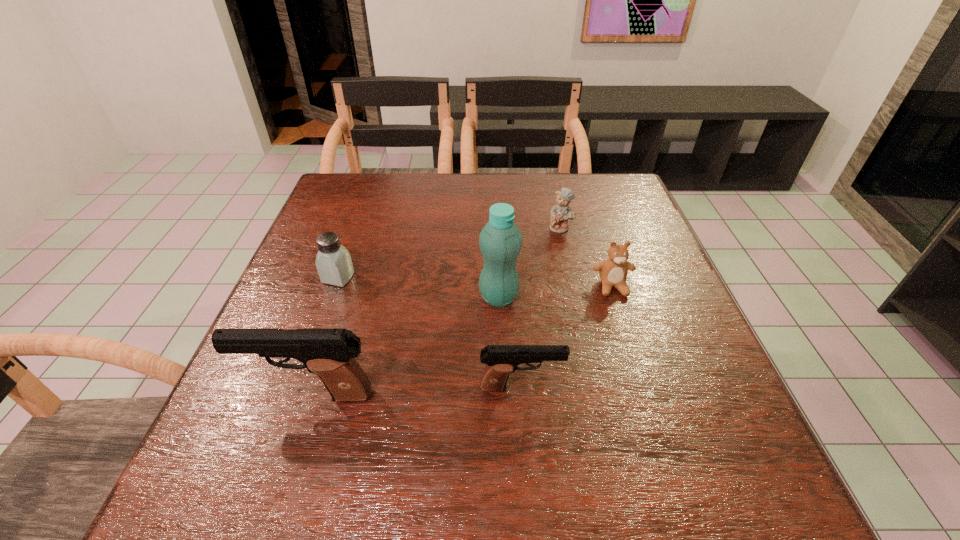
At what (x,y) coordinates should I click in order to perform the action: click on vacant space at the near edge. Please return your answer as a coordinate pair (x, y). Image resolution: width=960 pixels, height=540 pixels. Looking at the image, I should click on coord(540,438).

Locate an element on the screen. This screenshot has width=960, height=540. vacant position at the left edge of the desktop is located at coordinates (266, 365).

Find the location of a particular element. free region at the right edge of the desktop is located at coordinates (657, 360).

The image size is (960, 540). In order to click on vacant region at the far right corner of the desktop in this screenshot , I will do `click(603, 194)`.

Identify the location of vacant area that lies between the right pistol and the taller pistol. (416, 391).

Where is `free space between the right pistol and the left pistol`? This screenshot has width=960, height=540. free space between the right pistol and the left pistol is located at coordinates pos(416,391).

The height and width of the screenshot is (540, 960). What are the coordinates of `unoccupied position between the tallest object and the right pistol` in the screenshot? It's located at (510, 342).

What are the coordinates of `vacant area that lies between the nearer teddy bear and the left teddy bear` in the screenshot? It's located at (587, 258).

Locate an element on the screen. The image size is (960, 540). free space between the right teddy bear and the shorter pistol is located at coordinates (566, 337).

Find the location of a particular element. The image size is (960, 540). vacant space that's between the fifth shortest object and the rightmost object is located at coordinates (462, 341).